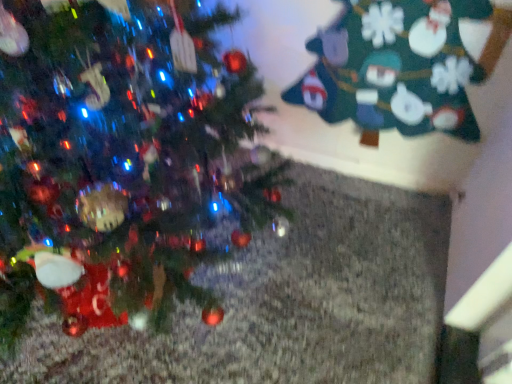
Image resolution: width=512 pixels, height=384 pixels. What do you see at coordinates (395, 67) in the screenshot?
I see `green felt christmas tree at upper right, which appears as the 1th christmas tree when viewed from the right` at bounding box center [395, 67].

What are the coordinates of `green felt christmas tree at upper right, which appears as the 1th christmas tree when viewed from the right` in the screenshot? It's located at (395, 67).

Describe the element at coordinates (119, 162) in the screenshot. The image size is (512, 384). I see `green matte christmas tree at left, the 2th christmas tree viewed from the right` at that location.

How much space does green matte christmas tree at left, the 1th christmas tree when ordered from left to right, occupy horizontally?

green matte christmas tree at left, the 1th christmas tree when ordered from left to right, is 39.18 inches wide.

Image resolution: width=512 pixels, height=384 pixels. I want to click on green matte christmas tree at left, the 1th christmas tree when ordered from left to right, so click(x=119, y=162).

You are a GUI agent. You are given a task and a screenshot of the screen. Output one action in this format:
    pyautogui.click(x=<x>, y=<y>)
    Task: Click on the green felt christmas tree at upper right, which appears as the 1th christmas tree when viewed from the right
    This screenshot has width=512, height=384.
    Given the screenshot: What is the action you would take?
    pyautogui.click(x=395, y=67)

Does green matte christmas tree at left, the 1th christmas tree when ordered from left to right, appear on the left side of green felt christmas tree at upper right, which is the 2th christmas tree from left to right?

Correct, you'll find green matte christmas tree at left, the 1th christmas tree when ordered from left to right, to the left of green felt christmas tree at upper right, which is the 2th christmas tree from left to right.

Which is in front, green matte christmas tree at left, the 1th christmas tree when ordered from left to right, or green felt christmas tree at upper right, which appears as the 1th christmas tree when viewed from the right?

green matte christmas tree at left, the 1th christmas tree when ordered from left to right.

Is point (122, 82) behind point (468, 114)?

No, it is not.

From the image's perspective, is green matte christmas tree at left, the 1th christmas tree when ordered from left to right, over green felt christmas tree at upper right, which is the 2th christmas tree from left to right?

Incorrect, from the image's perspective, green matte christmas tree at left, the 1th christmas tree when ordered from left to right, is lower than green felt christmas tree at upper right, which is the 2th christmas tree from left to right.

From a real-world perspective, is green matte christmas tree at left, the 2th christmas tree viewed from the right, physically below green felt christmas tree at upper right, which appears as the 1th christmas tree when viewed from the right?

Incorrect, from a real-world perspective, green matte christmas tree at left, the 2th christmas tree viewed from the right, is higher than green felt christmas tree at upper right, which appears as the 1th christmas tree when viewed from the right.

Between green matte christmas tree at left, the 2th christmas tree viewed from the right, and green felt christmas tree at upper right, which is the 2th christmas tree from left to right, which one has larger width?

green matte christmas tree at left, the 2th christmas tree viewed from the right, is wider.

Considering the sizes of green matte christmas tree at left, the 2th christmas tree viewed from the right, and green felt christmas tree at upper right, which is the 2th christmas tree from left to right, in the image, is green matte christmas tree at left, the 2th christmas tree viewed from the right, taller or shorter than green felt christmas tree at upper right, which is the 2th christmas tree from left to right,?

green matte christmas tree at left, the 2th christmas tree viewed from the right, is taller than green felt christmas tree at upper right, which is the 2th christmas tree from left to right.

Which of these two, green matte christmas tree at left, the 2th christmas tree viewed from the right, or green felt christmas tree at upper right, which is the 2th christmas tree from left to right, is smaller?

With smaller size is green felt christmas tree at upper right, which is the 2th christmas tree from left to right.

Can green felt christmas tree at upper right, which is the 2th christmas tree from left to right, be found inside green matte christmas tree at left, the 1th christmas tree when ordered from left to right?

No, green felt christmas tree at upper right, which is the 2th christmas tree from left to right, is not inside green matte christmas tree at left, the 1th christmas tree when ordered from left to right.

Are green matte christmas tree at left, the 2th christmas tree viewed from the right, and green felt christmas tree at upper right, which is the 2th christmas tree from left to right, beside each other?

No.

Is green matte christmas tree at left, the 1th christmas tree when ordered from left to right, facing towards green felt christmas tree at upper right, which is the 2th christmas tree from left to right?

No, green matte christmas tree at left, the 1th christmas tree when ordered from left to right, is not facing towards green felt christmas tree at upper right, which is the 2th christmas tree from left to right.

The height and width of the screenshot is (384, 512). What are the coordinates of `christmas tree on the left of green felt christmas tree at upper right, which appears as the 1th christmas tree when viewed from the right` in the screenshot? It's located at (119, 162).

Which object is positioned more to the right, green felt christmas tree at upper right, which appears as the 1th christmas tree when viewed from the right, or green matte christmas tree at left, the 1th christmas tree when ordered from left to right?

green felt christmas tree at upper right, which appears as the 1th christmas tree when viewed from the right, is more to the right.

Does green felt christmas tree at upper right, which is the 2th christmas tree from left to right, come behind green matte christmas tree at left, the 1th christmas tree when ordered from left to right?

That is True.

Is point (447, 7) positioned after point (140, 289)?

Yes, it is behind point (140, 289).

From the image's perspective, between green felt christmas tree at upper right, which is the 2th christmas tree from left to right, and green matte christmas tree at left, the 1th christmas tree when ordered from left to right, which one is located above?

green felt christmas tree at upper right, which is the 2th christmas tree from left to right.

From a real-world perspective, who is located higher, green felt christmas tree at upper right, which is the 2th christmas tree from left to right, or green matte christmas tree at left, the 2th christmas tree viewed from the right?

green matte christmas tree at left, the 2th christmas tree viewed from the right.

Considering the relative sizes of green felt christmas tree at upper right, which appears as the 1th christmas tree when viewed from the right, and green matte christmas tree at left, the 2th christmas tree viewed from the right, in the image provided, is green felt christmas tree at upper right, which appears as the 1th christmas tree when viewed from the right, wider than green matte christmas tree at left, the 2th christmas tree viewed from the right,?

No, green felt christmas tree at upper right, which appears as the 1th christmas tree when viewed from the right, is not wider than green matte christmas tree at left, the 2th christmas tree viewed from the right.

Can you confirm if green felt christmas tree at upper right, which appears as the 1th christmas tree when viewed from the right, is shorter than green matte christmas tree at left, the 2th christmas tree viewed from the right?

Yes.

Looking at the image, does green felt christmas tree at upper right, which appears as the 1th christmas tree when viewed from the right, seem bigger or smaller compared to green matte christmas tree at left, the 2th christmas tree viewed from the right?

In the image, green felt christmas tree at upper right, which appears as the 1th christmas tree when viewed from the right, appears to be smaller than green matte christmas tree at left, the 2th christmas tree viewed from the right.

Does green felt christmas tree at upper right, which appears as the 1th christmas tree when viewed from the right, contain green matte christmas tree at left, the 1th christmas tree when ordered from left to right?

No, green matte christmas tree at left, the 1th christmas tree when ordered from left to right, is not a part of green felt christmas tree at upper right, which appears as the 1th christmas tree when viewed from the right.

Would you say green felt christmas tree at upper right, which appears as the 1th christmas tree when viewed from the right, is a long distance from green matte christmas tree at left, the 2th christmas tree viewed from the right?

green felt christmas tree at upper right, which appears as the 1th christmas tree when viewed from the right, is actually quite close to green matte christmas tree at left, the 2th christmas tree viewed from the right.

Is green felt christmas tree at upper right, which appears as the 1th christmas tree when viewed from the right, facing away from green matte christmas tree at left, the 1th christmas tree when ordered from left to right?

That's not correct — green felt christmas tree at upper right, which appears as the 1th christmas tree when viewed from the right, is not looking away from green matte christmas tree at left, the 1th christmas tree when ordered from left to right.

Can you tell me how much green felt christmas tree at upper right, which appears as the 1th christmas tree when viewed from the right, and green matte christmas tree at left, the 2th christmas tree viewed from the right, differ in facing direction?

There is a 86.8-degree angle between the facing directions of green felt christmas tree at upper right, which appears as the 1th christmas tree when viewed from the right, and green matte christmas tree at left, the 2th christmas tree viewed from the right.

Identify the location of christmas tree above the green matte christmas tree at left, the 1th christmas tree when ordered from left to right (from the image's perspective). (395, 67).

Identify the location of christmas tree above the green felt christmas tree at upper right, which is the 2th christmas tree from left to right (from a real-world perspective). (119, 162).

Where is `christmas tree located above the green matte christmas tree at left, the 1th christmas tree when ordered from left to right (from the image's perspective)`? The height and width of the screenshot is (384, 512). christmas tree located above the green matte christmas tree at left, the 1th christmas tree when ordered from left to right (from the image's perspective) is located at coordinates (395, 67).